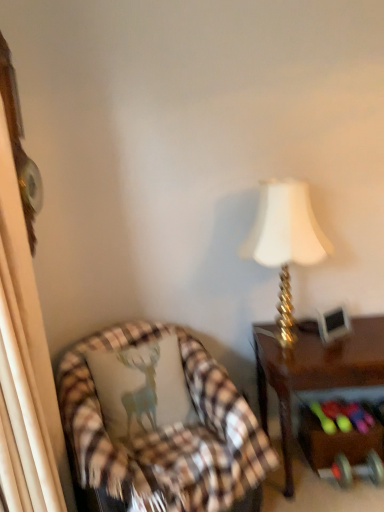
Measure the distance between point (364, 451) and camera.

Point (364, 451) and camera are 2.02 meters apart.

The width and height of the screenshot is (384, 512). I want to click on brown plaid chair at lower left, so click(x=164, y=430).

Describe the element at coordinates (141, 387) in the screenshot. I see `plaid fabric pillow at left` at that location.

Where is `brown wooden desk at right`? This screenshot has height=512, width=384. brown wooden desk at right is located at coordinates (314, 371).

Does plaid fabric pillow at left turn towards brown wooden desk at right?

No, plaid fabric pillow at left is not facing towards brown wooden desk at right.

From a real-world perspective, is plaid fabric pillow at left physically above brown wooden desk at right?

Yes, from a real-world perspective, plaid fabric pillow at left is over brown wooden desk at right

Which is less distant, (180, 403) or (282, 387)?

Point (180, 403).

Does plaid fabric pillow at left have a greater height compared to brown wooden desk at right?

No.

How distant is brown wooden desk at right from plaid fabric pillow at left?

brown wooden desk at right is 22.25 inches from plaid fabric pillow at left.

Is brown wooden desk at right oriented towards plaid fabric pillow at left?

No, brown wooden desk at right is not aimed at plaid fabric pillow at left.

Relative to plaid fabric pillow at left, is brown wooden desk at right in front or behind?

brown wooden desk at right is positioned farther from the viewer than plaid fabric pillow at left.

From the image's perspective, is brown wooden desk at right located beneath plaid fabric pillow at left?

Yes, from the image's perspective, brown wooden desk at right is below plaid fabric pillow at left.

Based on the photo, is gold metallic lamp at upper right touching brown plaid chair at lower left?

No, gold metallic lamp at upper right is not with brown plaid chair at lower left.

Is gold metallic lamp at upper right not within brown plaid chair at lower left?

gold metallic lamp at upper right lies outside brown plaid chair at lower left's area.

Would you say gold metallic lamp at upper right is to the left or to the right of brown plaid chair at lower left in the picture?

Based on their positions, gold metallic lamp at upper right is located to the right of brown plaid chair at lower left.

Is metallic silver dumbbell at lower right at the left side of plaid fabric pillow at left?

No.

Consider the image. From the image's perspective, is metallic silver dumbbell at lower right on plaid fabric pillow at left?

No, from the image's perspective, metallic silver dumbbell at lower right is not above plaid fabric pillow at left.

Which object is further away from the camera, metallic silver dumbbell at lower right or plaid fabric pillow at left?

Positioned behind is metallic silver dumbbell at lower right.

From a real-world perspective, which is physically above, metallic silver dumbbell at lower right or plaid fabric pillow at left?

In real-world perspective, plaid fabric pillow at left is above.

Is plaid fabric pillow at left inside brown plaid chair at lower left?

Yes, plaid fabric pillow at left is surrounded by brown plaid chair at lower left.

Which object is wider, brown plaid chair at lower left or plaid fabric pillow at left?

brown plaid chair at lower left is wider.

Is brown plaid chair at lower left positioned with its back to plaid fabric pillow at left?

That's right, brown plaid chair at lower left is facing away from plaid fabric pillow at left.

From the picture: From the image's perspective, is brown plaid chair at lower left on top of plaid fabric pillow at left?

Incorrect, from the image's perspective, brown plaid chair at lower left is lower than plaid fabric pillow at left.

Which is farther from the camera, (378, 327) or (363, 462)?

The point (363, 462) is farther from the camera.

Is metallic silver dumbbell at lower right surrounded by brown wooden desk at right?

Yes, brown wooden desk at right contains metallic silver dumbbell at lower right.

Could you tell me if brown wooden desk at right is turned towards metallic silver dumbbell at lower right?

No, brown wooden desk at right is not turned towards metallic silver dumbbell at lower right.

Are brown wooden desk at right and metallic silver dumbbell at lower right far apart?

That's not correct — brown wooden desk at right is a little close to metallic silver dumbbell at lower right.

Considering the positions of objects plaid fabric pillow at left and metallic silver dumbbell at lower right in the image provided, who is more to the right, plaid fabric pillow at left or metallic silver dumbbell at lower right?

metallic silver dumbbell at lower right is more to the right.

Is plaid fabric pillow at left inside the boundaries of metallic silver dumbbell at lower right, or outside?

The correct answer is: outside.

Between plaid fabric pillow at left and metallic silver dumbbell at lower right, which one has larger size?

With larger size is plaid fabric pillow at left.

Considering the sizes of plaid fabric pillow at left and metallic silver dumbbell at lower right in the image, is plaid fabric pillow at left taller or shorter than metallic silver dumbbell at lower right?

Considering their sizes, plaid fabric pillow at left has more height than metallic silver dumbbell at lower right.

Find the location of a particular element. The height and width of the screenshot is (512, 384). desk located below the plaid fabric pillow at left (from the image's perspective) is located at coordinates click(x=314, y=371).

I want to click on pillow on the left side of brown wooden desk at right, so click(141, 387).

Considering their positions, is brown plaid chair at lower left positioned further to brown wooden desk at right than plaid fabric pillow at left?

plaid fabric pillow at left is further to brown wooden desk at right.

Based on their spatial positions, is gold metallic lamp at upper right or metallic silver dumbbell at lower right closer to plaid fabric pillow at left?

gold metallic lamp at upper right.

Which object lies further to the anchor point brown plaid chair at lower left, plaid fabric pillow at left or gold metallic lamp at upper right?

gold metallic lamp at upper right.

Looking at the image, which one is located further to metallic silver dumbbell at lower right, plaid fabric pillow at left or brown plaid chair at lower left?

plaid fabric pillow at left is further to metallic silver dumbbell at lower right.

Looking at the image, which one is located closer to plaid fabric pillow at left, gold metallic lamp at upper right or brown plaid chair at lower left?

Among the two, brown plaid chair at lower left is located nearer to plaid fabric pillow at left.

Estimate the real-world distances between objects in this image. Which object is further from brown wooden desk at right, plaid fabric pillow at left or metallic silver dumbbell at lower right?

Based on the image, plaid fabric pillow at left appears to be further to brown wooden desk at right.

Looking at this image, looking at the image, which one is located further to metallic silver dumbbell at lower right, gold metallic lamp at upper right or brown wooden desk at right?

gold metallic lamp at upper right is positioned further to the anchor metallic silver dumbbell at lower right.

Which object lies nearer to the anchor point gold metallic lamp at upper right, brown plaid chair at lower left or plaid fabric pillow at left?

brown plaid chair at lower left lies closer to gold metallic lamp at upper right than the other object.

In order to click on desk between gold metallic lamp at upper right and metallic silver dumbbell at lower right in the vertical direction in this screenshot , I will do `click(314, 371)`.

At what (x,y) coordinates should I click in order to perform the action: click on desk situated between plaid fabric pillow at left and metallic silver dumbbell at lower right from left to right. Please return your answer as a coordinate pair (x, y). Image resolution: width=384 pixels, height=512 pixels. Looking at the image, I should click on pyautogui.click(x=314, y=371).

Identify the location of chair situated between plaid fabric pillow at left and brown wooden desk at right from left to right. The width and height of the screenshot is (384, 512). (164, 430).

At what (x,y) coordinates should I click in order to perform the action: click on chair between gold metallic lamp at upper right and metallic silver dumbbell at lower right in the vertical direction. Please return your answer as a coordinate pair (x, y). Image resolution: width=384 pixels, height=512 pixels. Looking at the image, I should click on (164, 430).